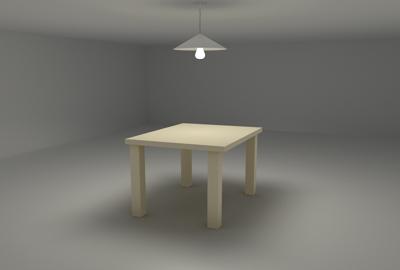
Where is `shadow of table`? The image size is (400, 270). shadow of table is located at coordinates (176, 206).